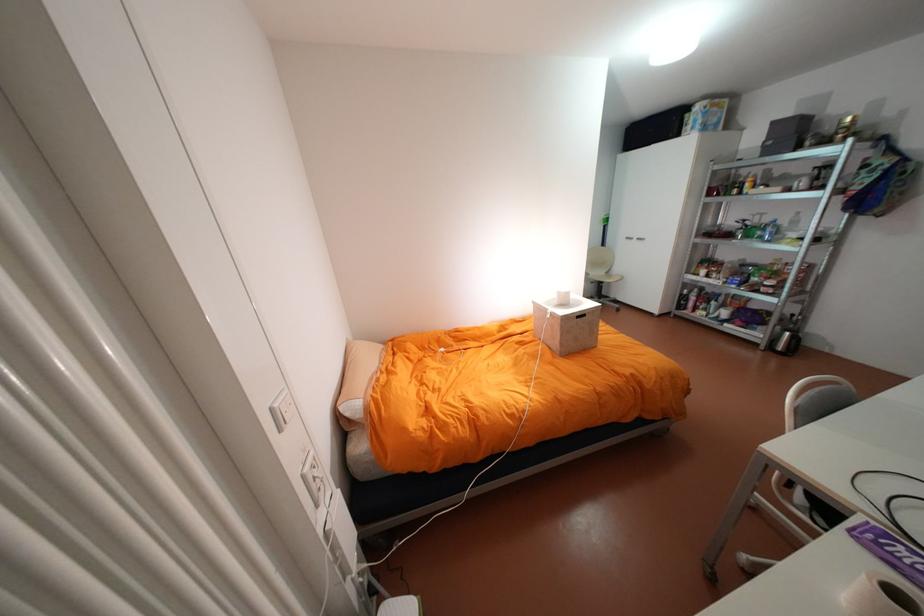
This screenshot has width=924, height=616. What do you see at coordinates (580, 321) in the screenshot?
I see `a box handle cutout` at bounding box center [580, 321].